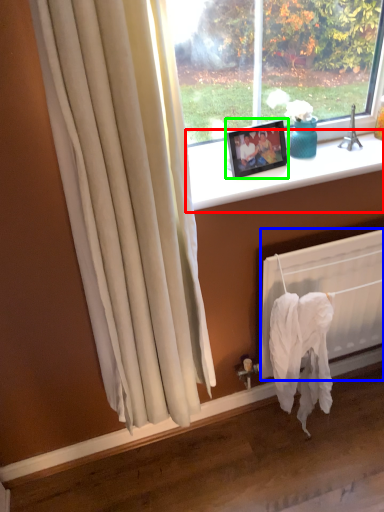
Question: Based on their relative distances, which object is nearer to window sill (highlighted by a red box)? Choose from radiator (highlighted by a blue box) and picture frame (highlighted by a green box).

Choices:
 (A) radiator
 (B) picture frame

Answer: (B)